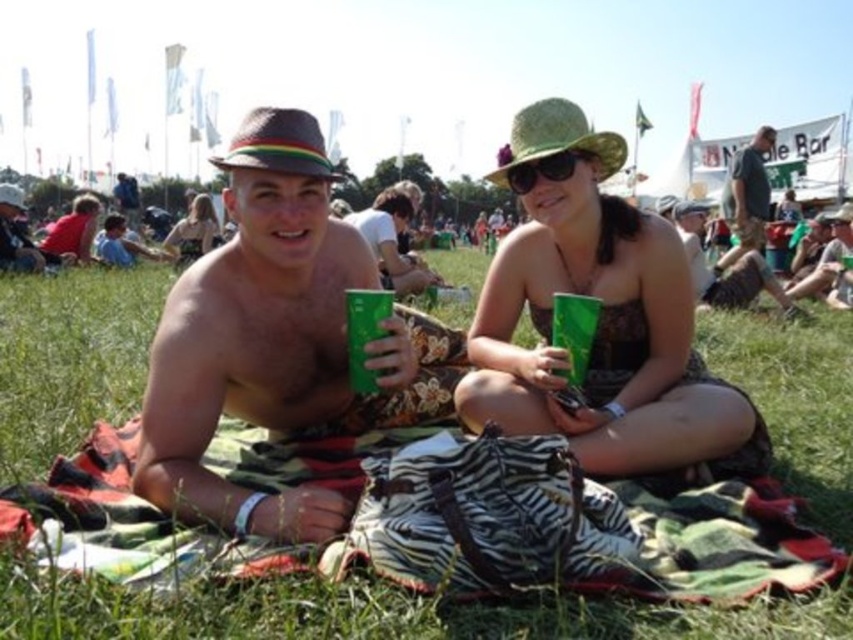
Question: Among these points, which one is nearest to the camera?

Choices:
 (A) (132, 189)
 (B) (619, 305)
 (C) (531, 177)
 (D) (44, 625)

Answer: (D)

Question: Does green matte sunglasses at center appear on the right side of matte brown hat at upper left?

Choices:
 (A) no
 (B) yes

Answer: (B)

Question: Which object is the farthest from the green grass at center?

Choices:
 (A) dark gray t-shirt at upper right
 (B) green fabric dress at center
 (C) matte brown hat at center

Answer: (A)

Question: Considering the real-world distances, which object is farthest from the matte brown hat at center?

Choices:
 (A) matte brown hat at upper left
 (B) green matte sunglasses at center
 (C) dark gray t-shirt at upper right

Answer: (A)

Question: Is the position of matte brown hat at center less distant than that of green matte sunglasses at center?

Choices:
 (A) yes
 (B) no

Answer: (A)

Question: Does green fabric dress at center appear on the left side of matte black dress at upper left?

Choices:
 (A) no
 (B) yes

Answer: (A)